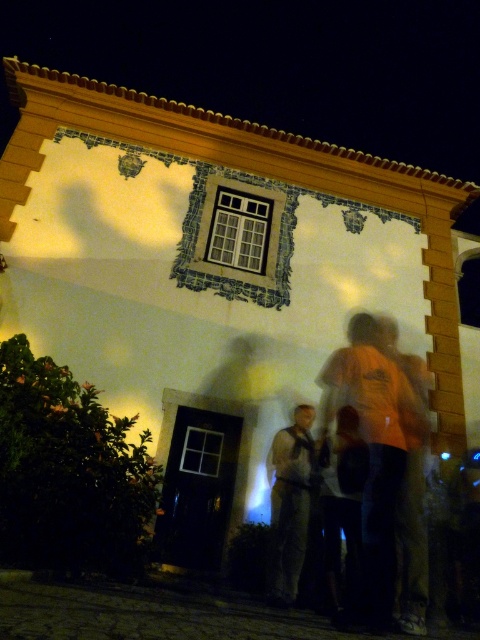
Who is more distant from viewer, (422, 413) or (312, 408)?

The point (422, 413) is behind.

Between point (425, 410) and point (307, 499), which one is positioned behind?

The point (425, 410) is behind.

Find the location of `orange t-shirt at right`. orange t-shirt at right is located at coordinates (381, 456).